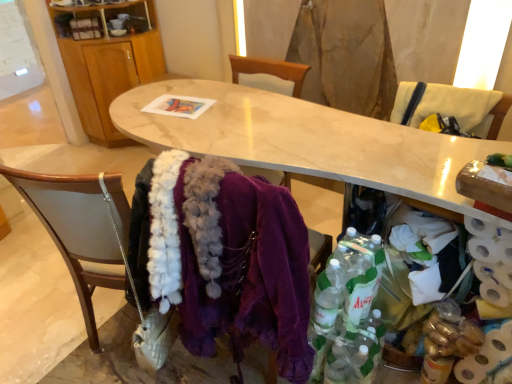
Question: Is white textured toilet paper at lower right positioned with its back to wooden chair at lower left, marked as the 1th chair in a bottom-to-top arrangement?

Choices:
 (A) no
 (B) yes

Answer: (A)

Question: Can you confirm if white textured toilet paper at lower right is taller than wooden chair at lower left, which ranks as the first chair in left-to-right order?

Choices:
 (A) yes
 (B) no

Answer: (B)

Question: Is white textured toilet paper at lower right wider than wooden chair at lower left, which ranks as the first chair in left-to-right order?

Choices:
 (A) no
 (B) yes

Answer: (A)

Question: Is white textured toilet paper at lower right further to camera compared to wooden chair at lower left, which ranks as the first chair in left-to-right order?

Choices:
 (A) yes
 (B) no

Answer: (A)

Question: Is white textured toilet paper at lower right outside wooden chair at lower left, marked as the 1th chair in a bottom-to-top arrangement?

Choices:
 (A) yes
 (B) no

Answer: (A)

Question: From the image's perspective, is marble table at center positioned above or below white fabric chair at upper right, placed as the first chair when sorted from right to left?

Choices:
 (A) below
 (B) above

Answer: (A)

Question: Choose the correct answer: Is marble table at center inside white fabric chair at upper right, which ranks as the second chair in bottom-to-top order, or outside it?

Choices:
 (A) inside
 (B) outside

Answer: (B)

Question: Considering the positions of marble table at center and white fabric chair at upper right, which is the 1th chair in top-to-bottom order, in the image, is marble table at center taller or shorter than white fabric chair at upper right, which is the 1th chair in top-to-bottom order,?

Choices:
 (A) short
 (B) tall

Answer: (B)

Question: Looking at their shapes, would you say marble table at center is wider or thinner than white fabric chair at upper right, placed as the second chair when sorted from left to right?

Choices:
 (A) thin
 (B) wide

Answer: (B)

Question: In terms of height, does white textured toilet paper at lower right look taller or shorter compared to white fabric chair at upper right, which ranks as the second chair in bottom-to-top order?

Choices:
 (A) tall
 (B) short

Answer: (A)

Question: Relative to white fabric chair at upper right, placed as the second chair when sorted from left to right, is white textured toilet paper at lower right in front or behind?

Choices:
 (A) behind
 (B) front

Answer: (B)

Question: Looking at the image, does white textured toilet paper at lower right seem bigger or smaller compared to white fabric chair at upper right, placed as the first chair when sorted from right to left?

Choices:
 (A) small
 (B) big

Answer: (B)

Question: Is white textured toilet paper at lower right inside or outside of white fabric chair at upper right, which ranks as the second chair in bottom-to-top order?

Choices:
 (A) inside
 (B) outside

Answer: (B)

Question: Is wooden cabinet at upper left spatially inside wooden armchair at right, or outside of it?

Choices:
 (A) outside
 (B) inside

Answer: (A)

Question: Considering the positions of wooden cabinet at upper left and wooden armchair at right in the image, is wooden cabinet at upper left wider or thinner than wooden armchair at right?

Choices:
 (A) thin
 (B) wide

Answer: (A)